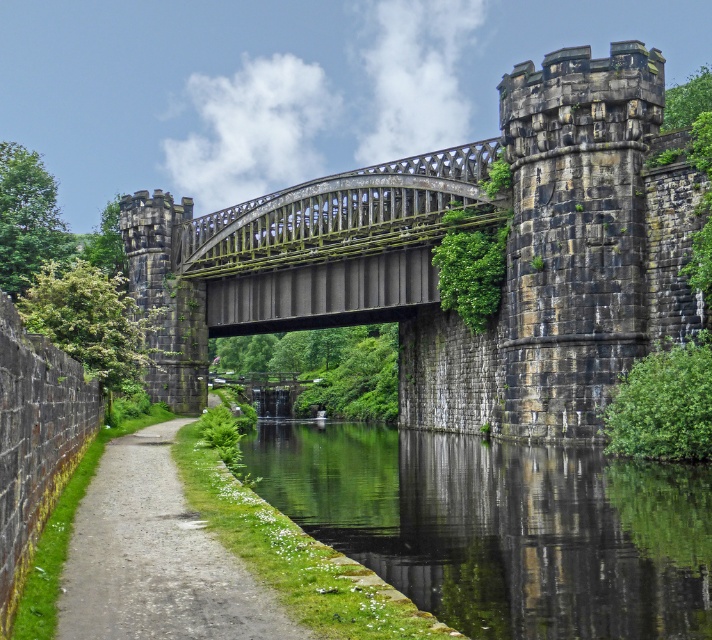
In the scene shown: Between stone castle at center and green mossy stone bridge at center, which one is positioned lower?

stone castle at center is below.

Between point (659, 268) and point (278, 221), which one is positioned in front?

Positioned in front is point (659, 268).

Measure the distance between stone castle at center and camera.

67.68 meters

Find the location of a particular element. stone castle at center is located at coordinates (434, 248).

Is point (502, 202) positioned in front of point (455, 467)?

No, (502, 202) is behind (455, 467).

Is the position of stone castle at center less distant than that of green reflective water at center?

No, stone castle at center is further to the viewer.

At what (x,y) coordinates should I click in order to perform the action: click on stone castle at center. Please return your answer as a coordinate pair (x, y). The height and width of the screenshot is (640, 712). Looking at the image, I should click on (434, 248).

This screenshot has width=712, height=640. Identify the location of stone castle at center. (434, 248).

Does stone castle at center have a greater height compared to dirt/gravel path at lower left?

Yes, stone castle at center is taller than dirt/gravel path at lower left.

Is point (184, 257) farther from viewer compared to point (108, 534)?

Yes, point (184, 257) is behind point (108, 534).

Identify the location of stone castle at center. This screenshot has width=712, height=640. (434, 248).